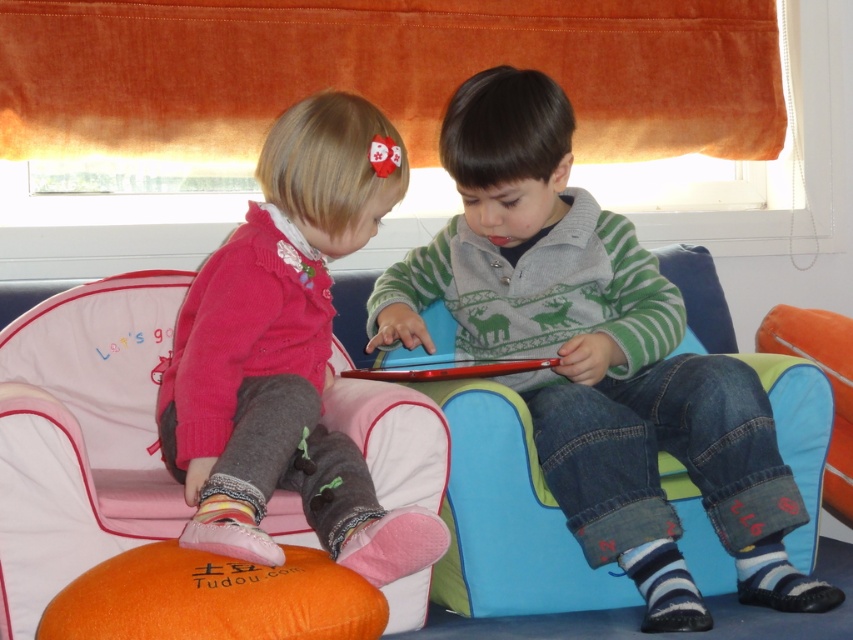
You are designing a playroom and need to ensure that the matte pink sweater at center can fit on a shelf designed for items narrower than the orange fabric bean bag at lower left. Based on the scene, will the sweater fit on the shelf?

The matte pink sweater at center is narrower than the orange fabric bean bag at lower left, so it will fit on the shelf designed for items narrower than the bean bag.

You are a parent trying to find your child who is wearing a matte pink sweater at center. You see the orange fabric bean bag at lower left in the room. Where would you look relative to the bean bag?

The matte pink sweater at center is in front of the orange fabric bean bag at lower left, so you should look in the direction facing the bean bag to find your child wearing the sweater.